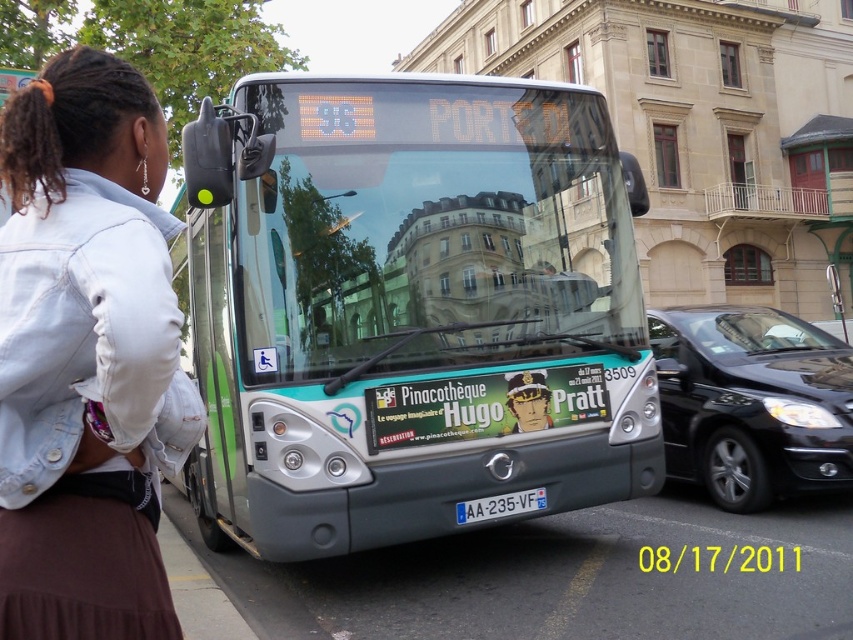
You are a pedestrian standing on the sidewalk and see the metallic silver bus at center and the black glossy sedan at center. Which vehicle is closer to you?

The metallic silver bus at center is closer to you because it is positioned to the left of the black glossy sedan at center, which places it in front of the sedan from your perspective.